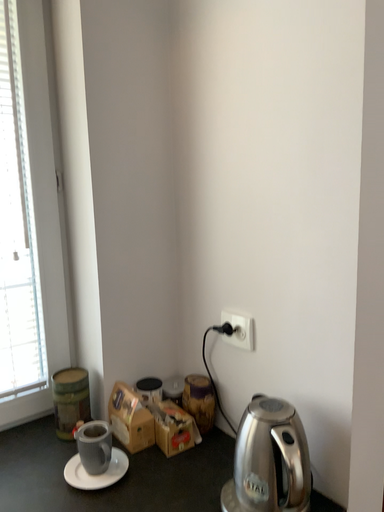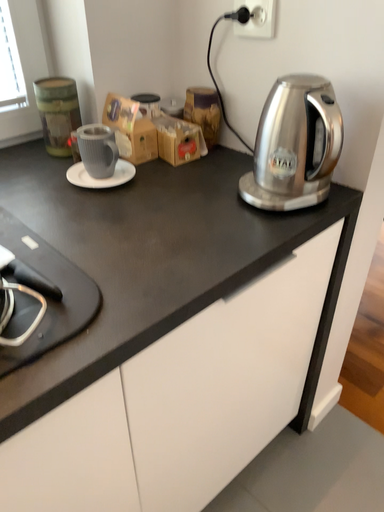
Question: How did the camera likely rotate when shooting the video?

Choices:
 (A) rotated upward
 (B) rotated downward

Answer: (B)